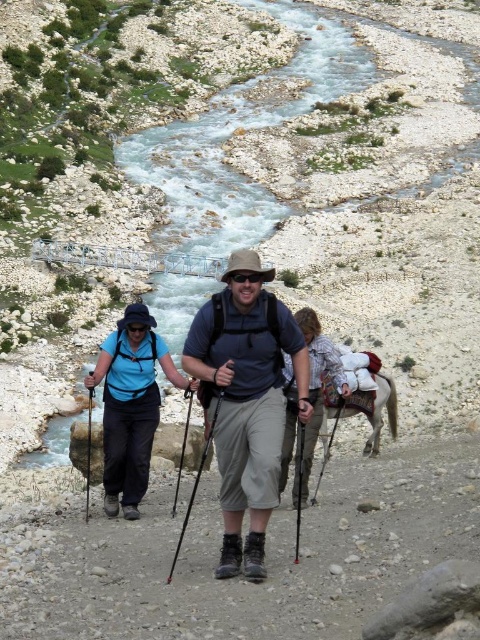
What is the color of the fabric at the point with coordinates (266, 557)?

The point at (266, 557) is on gray fabric pants at center.

You are a hiker planning to cross the river using the rocks. You see the gray fabric pants at center and the matte blue shirt at center. Which object is closer to the riverbank?

The gray fabric pants at center is 2.75 meters from matte blue shirt at center. However, the description does not provide information about their distance to the riverbank, so it cannot be determined which is closer to the riverbank.

You are a drone operator tasked with capturing aerial footage of the hikers in the scene. The drone is currently hovering at an altitude of 20 meters. If the matte blue shirt at center is 18.14 meters away from the camera, can the drone safely descend to 15 meters without getting too close to the hiker?

The matte blue shirt at center is 18.14 meters away from the camera. Since the drone is at 20 meters altitude and needs to descend to 15 meters, it would still maintain a distance of at least 15 meters from the hiker, which is safe. Therefore, the drone can descend to 15 meters safely.